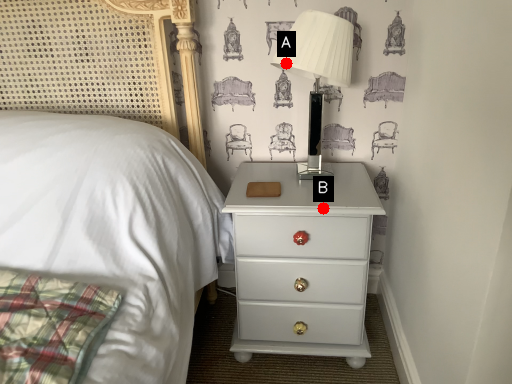
Question: Two points are circled on the image, labeled by A and B beside each circle. Among these points, which one is farthest from the camera?

Choices:
 (A) A is further
 (B) B is further

Answer: (A)